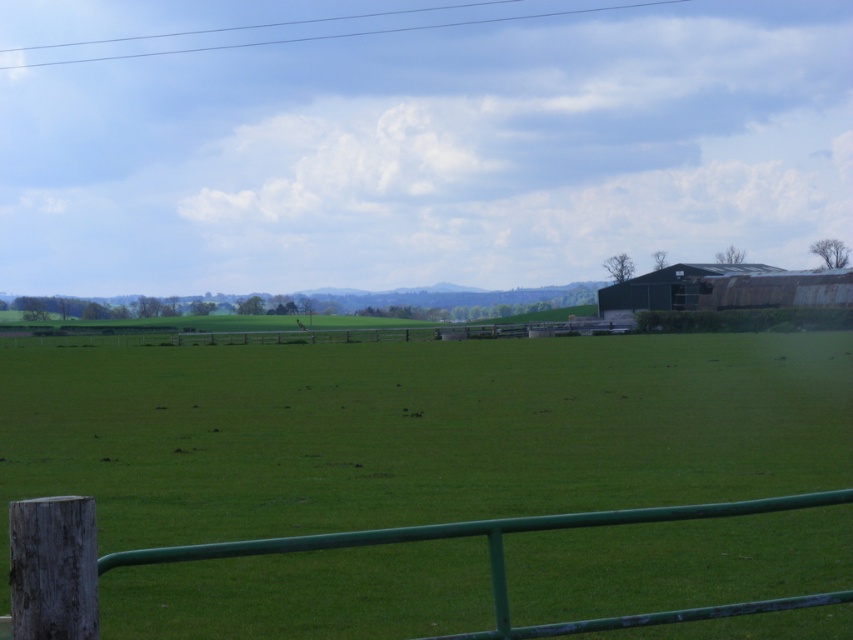
Can you confirm if green grass pasture at center is positioned to the right of green painted wood at lower center?

Correct, you'll find green grass pasture at center to the right of green painted wood at lower center.

Who is more distant from viewer, (573, 550) or (267, 548)?

The point (573, 550) is behind.

The image size is (853, 640). Identify the location of green grass pasture at center. (416, 429).

This screenshot has height=640, width=853. What are the coordinates of `green grass pasture at center` in the screenshot? It's located at (416, 429).